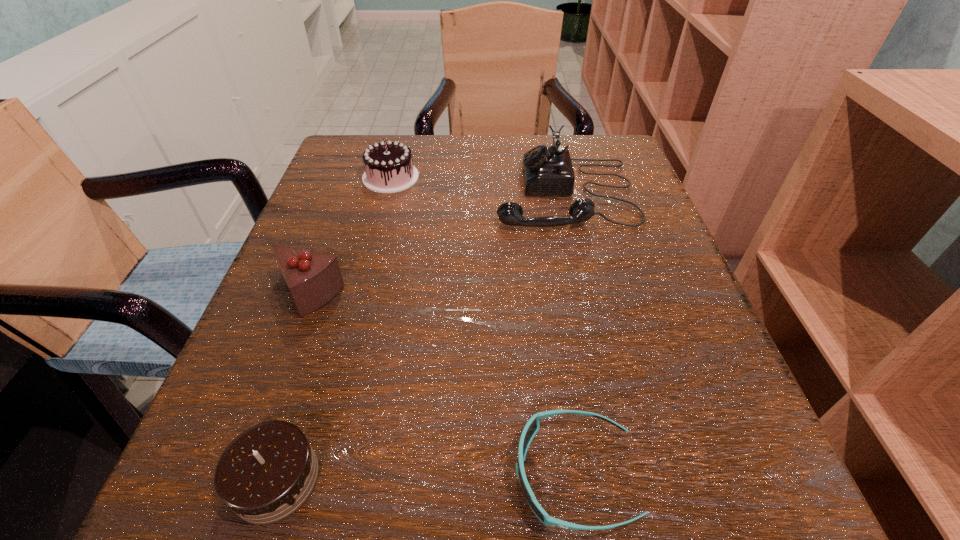
Find the location of a particular element. The width and height of the screenshot is (960, 540). vacant space located 0.190m on the right of the nearest chocolate cake is located at coordinates [487, 479].

This screenshot has width=960, height=540. I want to click on vacant space located 0.210m on the front-facing side of the sunglasses, so click(328, 475).

At what (x,y) coordinates should I click in order to perform the action: click on blank space located on the front-facing side of the sunglasses. Please return your answer as a coordinate pair (x, y). The image size is (960, 540). Looking at the image, I should click on (284, 475).

Image resolution: width=960 pixels, height=540 pixels. What are the coordinates of `free space located 0.350m on the front-facing side of the sunglasses` in the screenshot? It's located at (204, 475).

In order to click on telephone located at the far edge in this screenshot , I will do `click(546, 170)`.

The image size is (960, 540). In order to click on chocolate cake located in the far edge section of the desktop in this screenshot , I will do `click(389, 168)`.

Locate an element on the screen. This screenshot has width=960, height=540. chocolate cake that is positioned at the near edge is located at coordinates (269, 471).

Identify the location of sunglasses located at the near edge. (532, 426).

The width and height of the screenshot is (960, 540). I want to click on telephone present at the right edge, so click(x=546, y=170).

This screenshot has height=540, width=960. I want to click on sunglasses present at the right edge, so click(x=532, y=426).